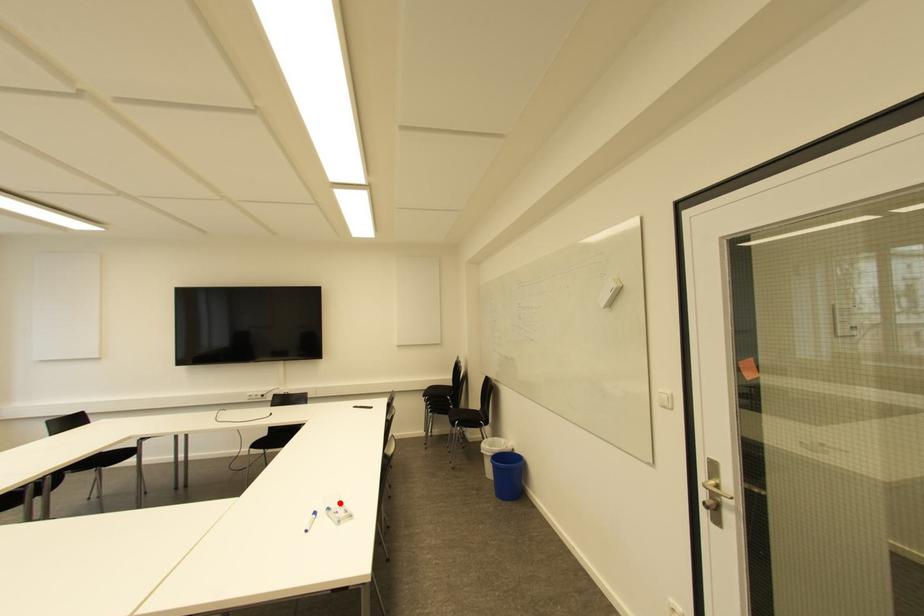
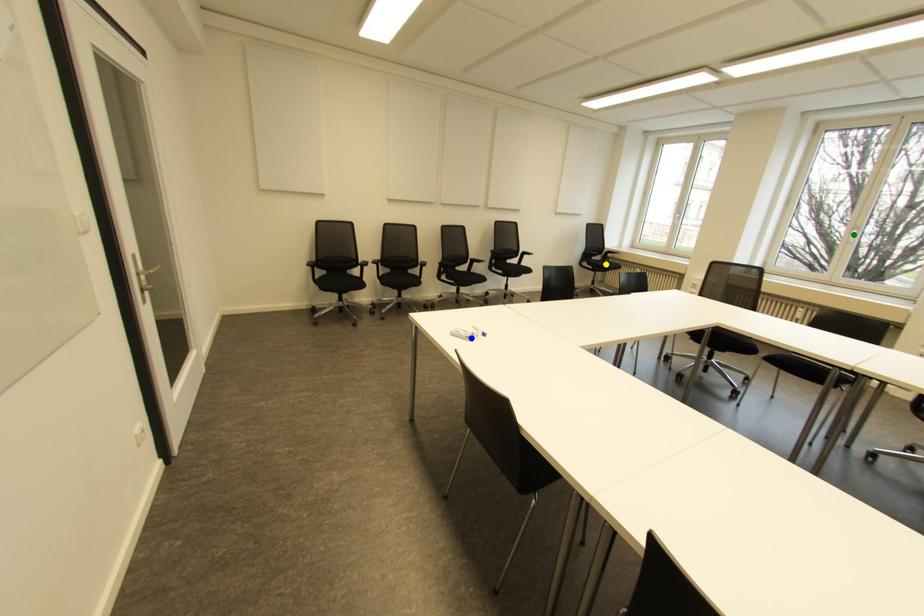
Question: I am providing you with two images of the same scene from different viewpoints. A red point is marked on the first image. You are given multiple points on the second image. In image 2, which mark is for the same physical point as the one in image 1?

Choices:
 (A) green point
 (B) blue point
 (C) yellow point

Answer: (B)